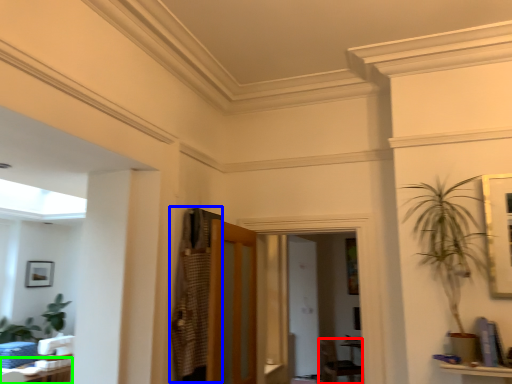
Question: Which is farther away from armchair (highlighted by a red box)? armoire (highlighted by a blue box) or table (highlighted by a green box)?

Choices:
 (A) armoire
 (B) table

Answer: (A)